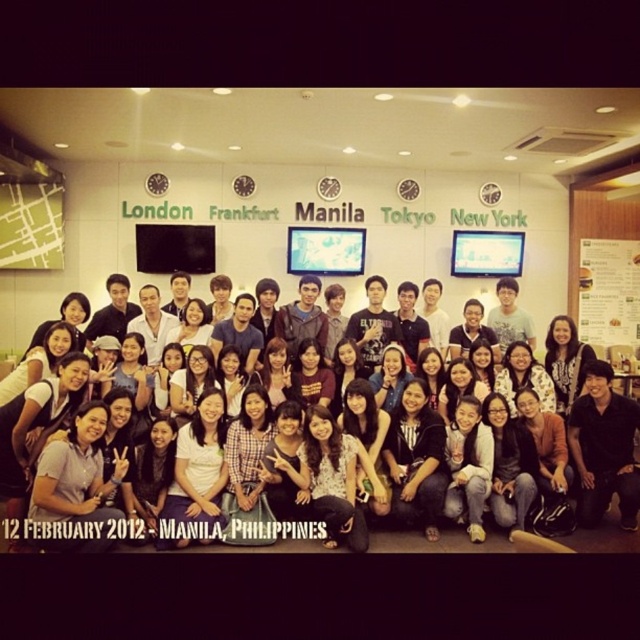
You are standing at the point marked by the coordinates point (614,541) in the group photo. You want to greet someone who is standing exactly 15 feet away from you. Can you reach them without moving?

The distance between you and the viewer is 16.52 feet, which is greater than 15 feet. Therefore, you cannot reach them without moving.

You are a photographer adjusting the lighting for a group photo. You notice the white fabric shirt at center and the white paper menu at right. Which object should you focus on to ensure proper exposure since one is closer to the camera?

The white fabric shirt at center should be focused on because it is in front of the white paper menu at right, making it closer to the camera.

Based on the photo, you are organizing a team photo and need to ensure that the white fabric shirt at center and the white paper menu at right are visible in the final shot. Based on their positions, which object is closer to the left side of the image?

The white fabric shirt at center is to the left of the white paper menu at right, so the white fabric shirt at center is closer to the left side of the image.